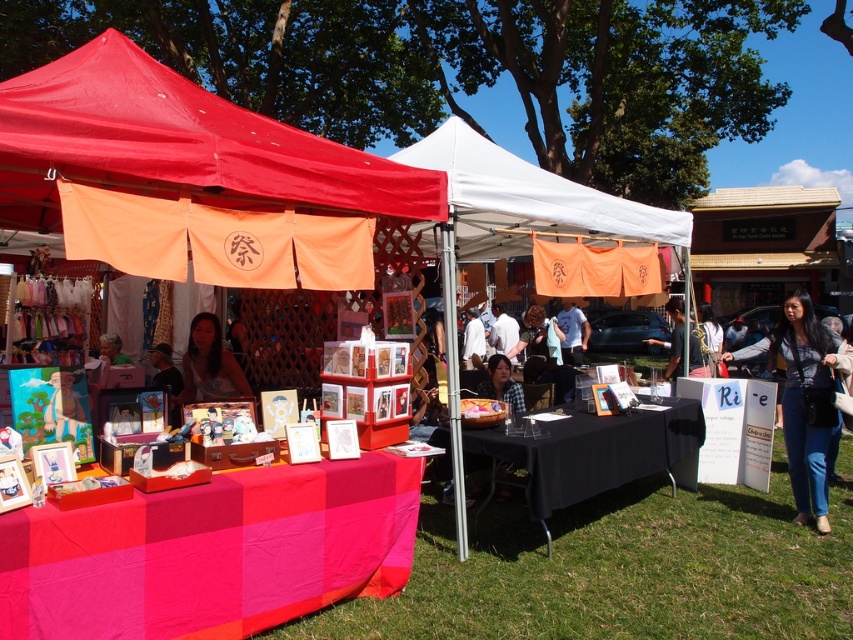
You are a customer at the market and want to buy a shirt. You see the black matte table at center and the matte black shirt at center. Which object is closer to you?

The black matte table at center is closer to you because it is in front of the matte black shirt at center.

You are a customer at the market and want to know which item is wider between the red fabric canopy at upper left and the black leather jacket at lower right. Can you tell me?

The red fabric canopy at upper left is wider than the black leather jacket at lower right.

You are a customer browsing the stalls at the outdoor market. You see the black leather jacket at lower right and the matte white shirt at center. Which item is closer to the ground?

The black leather jacket at lower right is positioned under the matte white shirt at center, so it is closer to the ground.